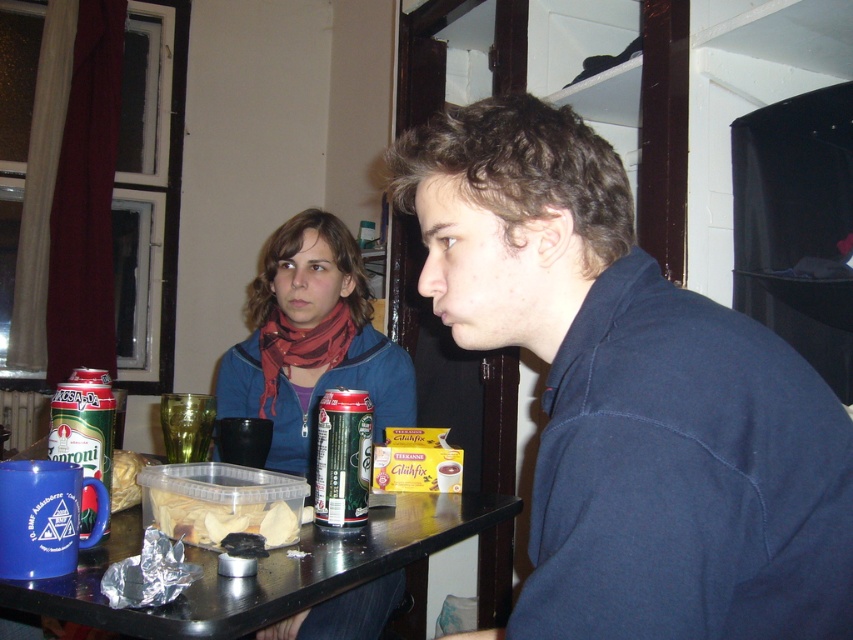
Question: Which of the following is the closest to the observer?

Choices:
 (A) blue fabric scarf at upper left
 (B) matte plastic chips at table center
 (C) black plastic table at lower center
 (D) green metallic can at center

Answer: (C)

Question: Estimate the real-world distances between objects in this image. Which object is closer to the black plastic table at lower center?

Choices:
 (A) green metallic can at center
 (B) matte plastic container of chips at table center
 (C) blue fleece jacket at center
 (D) blue fabric scarf at upper left

Answer: (B)

Question: Does blue fabric scarf at upper left have a larger size compared to green metallic can at center?

Choices:
 (A) no
 (B) yes

Answer: (B)

Question: Does green metallic can at center appear on the left side of green metallic can at lower left?

Choices:
 (A) no
 (B) yes

Answer: (A)

Question: Which of the following is the closest to the observer?

Choices:
 (A) (392, 547)
 (B) (553, 620)
 (C) (296, 500)
 (D) (138, 461)

Answer: (B)

Question: Is blue fleece jacket at center wider than green metallic can at center?

Choices:
 (A) no
 (B) yes

Answer: (B)